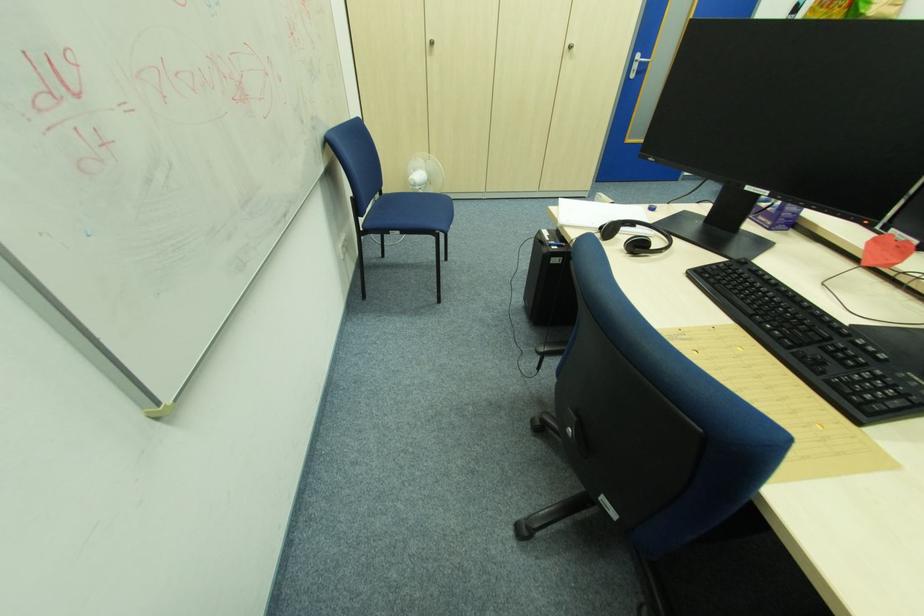
This screenshot has height=616, width=924. What do you see at coordinates (639, 60) in the screenshot?
I see `the silver door handle` at bounding box center [639, 60].